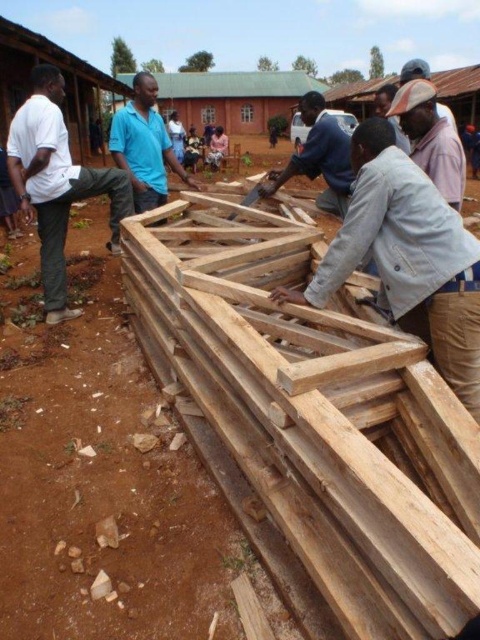
Question: Can you confirm if white matte pants at left is positioned below blue smooth shirt at center?

Choices:
 (A) no
 (B) yes

Answer: (B)

Question: Which of the following is the closest to the observer?

Choices:
 (A) (145, 173)
 (B) (57, 285)
 (C) (370, 188)

Answer: (C)

Question: Which of these objects is positioned closest to the brown woven hat at upper right?

Choices:
 (A) white matte pants at left
 (B) light brown wood at center

Answer: (B)

Question: Is white matte pants at left to the left of brown woven hat at upper right from the viewer's perspective?

Choices:
 (A) no
 (B) yes

Answer: (B)

Question: Is blue smooth shirt at center above brown woven hat at upper right?

Choices:
 (A) no
 (B) yes

Answer: (B)

Question: Which of these objects is positioned closest to the white matte pants at left?

Choices:
 (A) brown woven hat at upper right
 (B) light brown wood at center
 (C) wooden frame at center

Answer: (B)